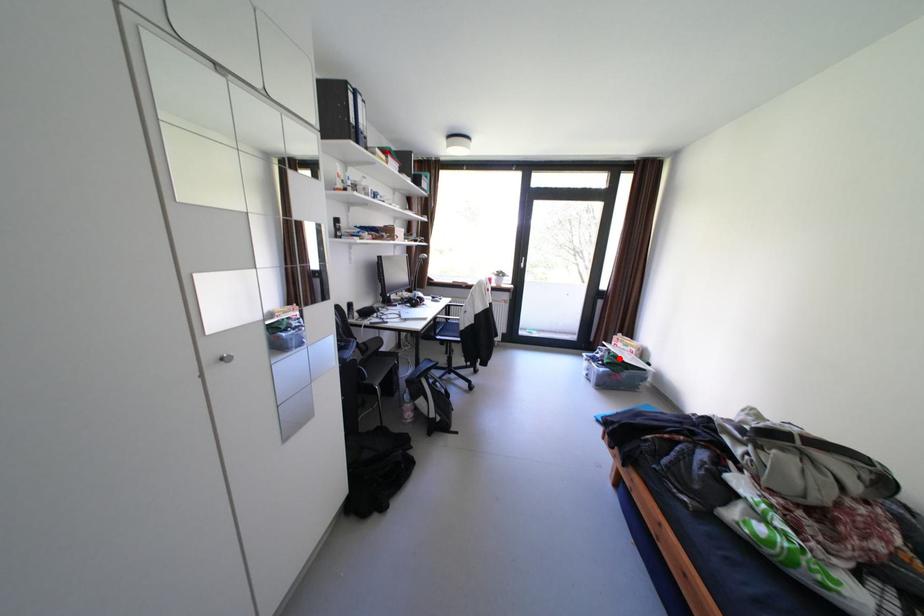
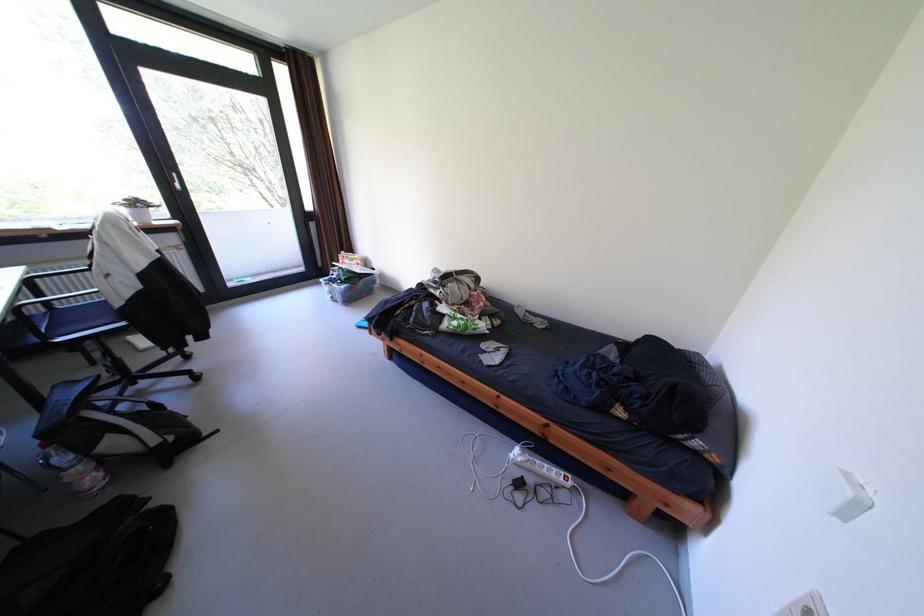
Question: I am providing you with two images of the same scene from different viewpoints. Image1 has a red point marked. In image2, the corresponding 3D location appears at what relative position? Reply with the corresponding letter.

Choices:
 (A) Closer
 (B) Farther

Answer: (A)